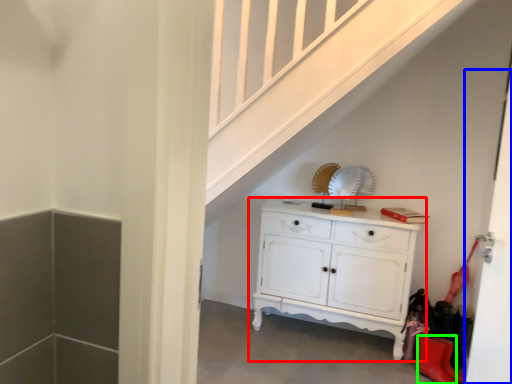
Question: Which object is the closest to the chest of drawers (highlighted by a red box)? Choose among these: door (highlighted by a blue box) or shoe (highlighted by a green box).

Choices:
 (A) door
 (B) shoe

Answer: (B)